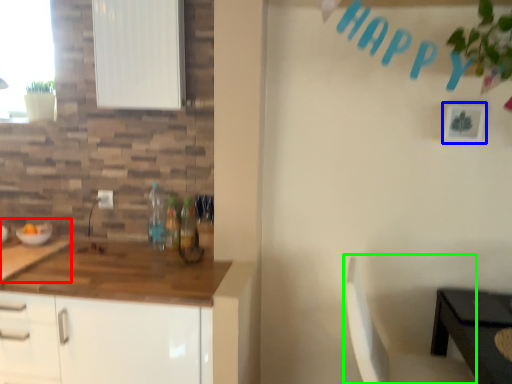
Question: Considering the real-world distances, which object is closest to sink (highlighted by a red box)? picture frame (highlighted by a blue box) or chair (highlighted by a green box).

Choices:
 (A) picture frame
 (B) chair

Answer: (B)